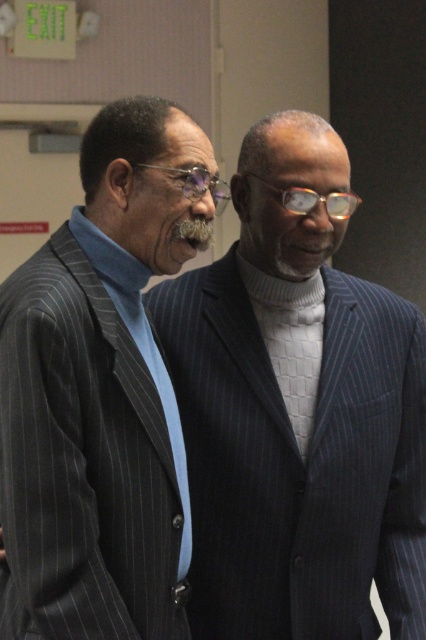
Between pinstriped suit at left and clear plastic glasses at center, which one has more height?

pinstriped suit at left

Between point (144, 227) and point (354, 196), which one is positioned behind?

Point (354, 196)

Locate an element on the screen. The image size is (426, 640). pinstriped suit at left is located at coordinates (101, 392).

The width and height of the screenshot is (426, 640). Identify the location of pinstriped suit at left. (101, 392).

Consider the image. Is dark blue pinstripe suit at center taller than clear plastic glasses at center?

Answer: Yes, dark blue pinstripe suit at center is taller than clear plastic glasses at center.

Does point (325, 390) lie behind point (287, 205)?

Yes, it is behind point (287, 205).

At what (x,y) coordinates should I click in order to perform the action: click on dark blue pinstripe suit at center. Please return your answer as a coordinate pair (x, y). The width and height of the screenshot is (426, 640). Looking at the image, I should click on (296, 413).

Which of these two, dark blue pinstripe suit at center or pinstriped suit at left, stands taller?

dark blue pinstripe suit at center

Does dark blue pinstripe suit at center have a greater width compared to pinstriped suit at left?

Yes, dark blue pinstripe suit at center is wider than pinstriped suit at left.

Does point (284, 582) come farther from viewer compared to point (144, 115)?

Yes, it is.

The width and height of the screenshot is (426, 640). I want to click on dark blue pinstripe suit at center, so click(x=296, y=413).